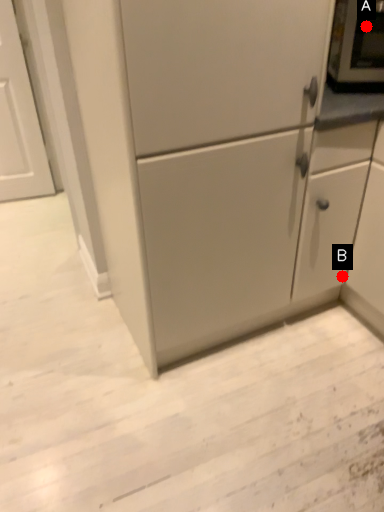
Question: Two points are circled on the image, labeled by A and B beside each circle. Among these points, which one is nearest to the camera?

Choices:
 (A) A is closer
 (B) B is closer

Answer: (A)